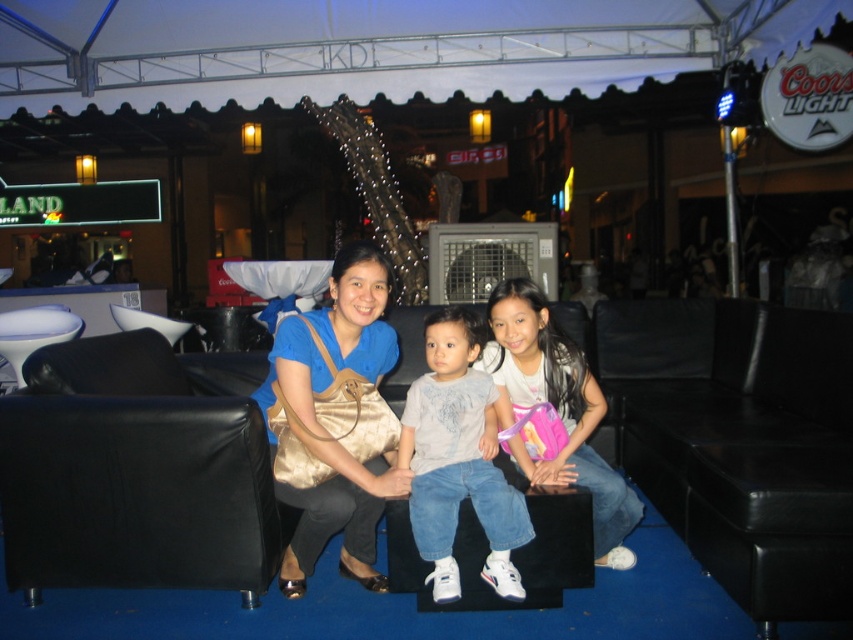
You are standing in front of the stage at the event and want to walk towards the two points marked in the image. Which point, point [318,515] or point [614,474], is closer to you?

Point [318,515] is closer to you than point [614,474].

You are a photographer trying to capture a closeup shot of the matte gold purse at center and the white cotton shirt at center. Based on their positions, which object should you focus on first to ensure both are in frame without moving the camera?

The matte gold purse at center is wider than the white cotton shirt at center, so you should focus on the matte gold purse at center first to ensure both fit within the camera frame.